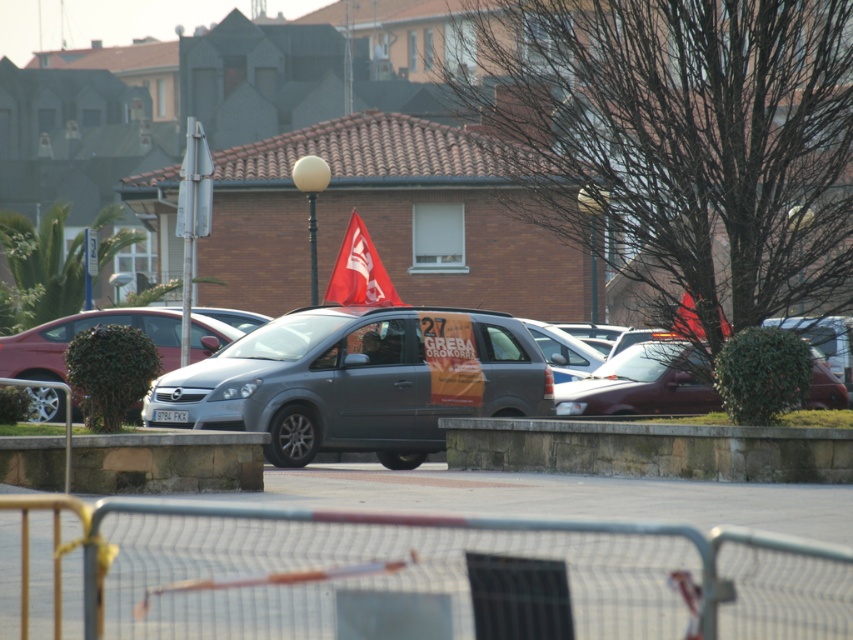
You are a pedestrian trying to cross the street and see the metallic gray van at center and the matte red flag at center. Which object is closer to you?

The metallic gray van at center is closer to you because it is positioned under the matte red flag at center, meaning the van is in front of the flag.

Based on the photo, you are a pedestrian trying to cross the street where the matte gray van at center and the matte red flag at center are located. The crosswalk is 10 feet wide. Can you safely cross without stepping into the road where the barricade is?

The distance between the matte gray van at center and the matte red flag at center is 8.79 feet, which is less than the 10 feet width of the crosswalk. Therefore, you can safely cross without stepping into the road where the barricade is.

You are a photographer trying to capture the entire scene of the urban street. You notice two points marked in the image at coordinates point (625, 394) and point (395, 301). Which point is closer to your camera lens?

Point (395, 301) is closer to the camera lens because it is less further than point (625, 394).